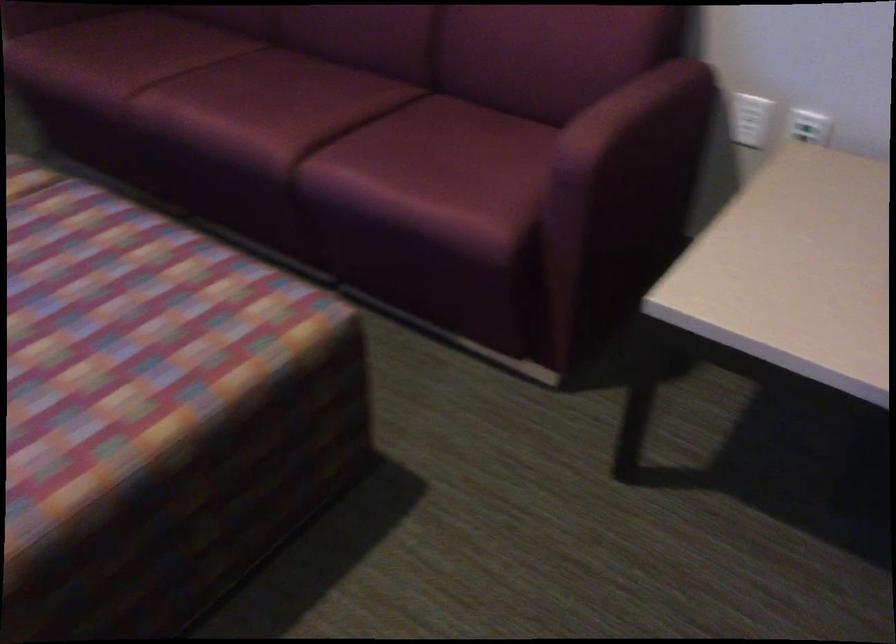
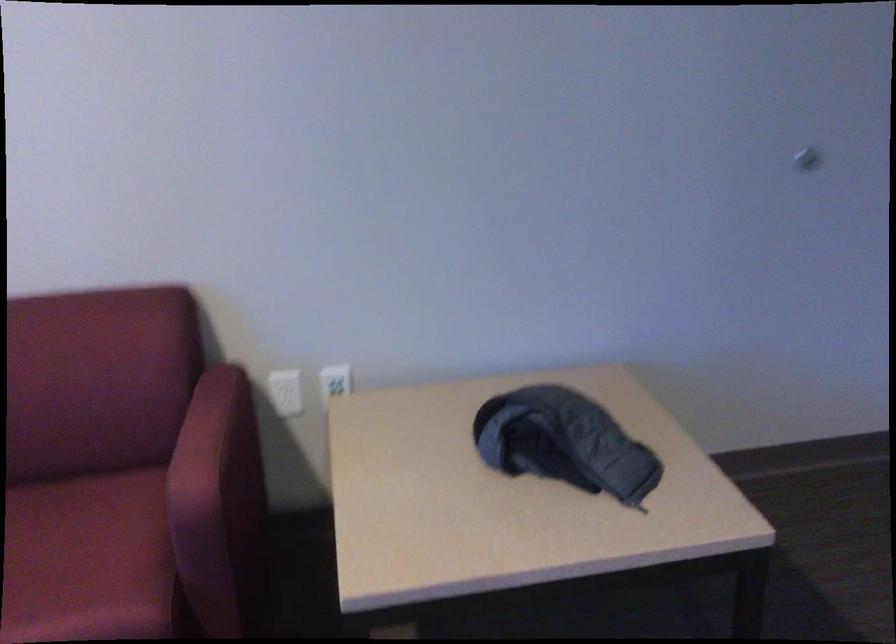
Locate, in the second image, the point that corresponds to (484,176) in the first image.

(88, 560)